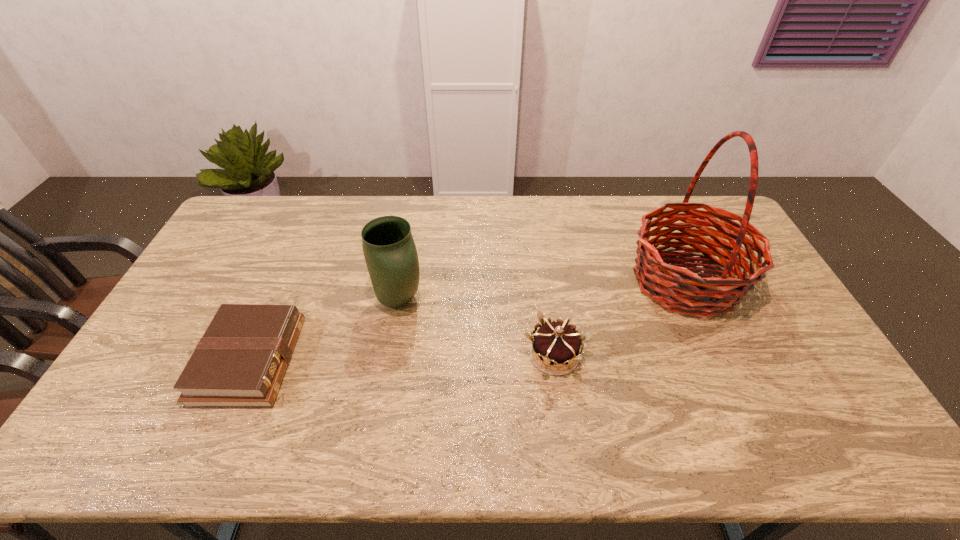
Find the location of a particular element. object that is the closest to the tallest object is located at coordinates (556, 343).

Where is `vacant area in the image that satisfies the following two spatial constraints: 1. on the front side of the crown; 2. on the left side of the third shortest object`? vacant area in the image that satisfies the following two spatial constraints: 1. on the front side of the crown; 2. on the left side of the third shortest object is located at coordinates (390, 355).

Where is `vacant area in the image that satisfies the following two spatial constraints: 1. on the handle side of the basket; 2. on the front side of the second tallest object`? This screenshot has width=960, height=540. vacant area in the image that satisfies the following two spatial constraints: 1. on the handle side of the basket; 2. on the front side of the second tallest object is located at coordinates (694, 300).